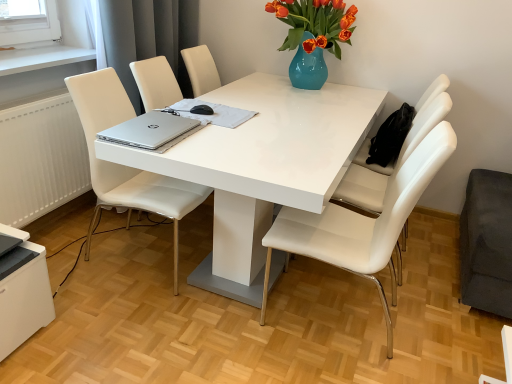
At what (x,y) coordinates should I click in order to perform the action: click on vacant area that lies between white glossy desktop at lower left and white leather chair at right, which ranks as the second chair in left-to-right order. Please return your answer as a coordinate pair (x, y). The height and width of the screenshot is (384, 512). Looking at the image, I should click on (164, 333).